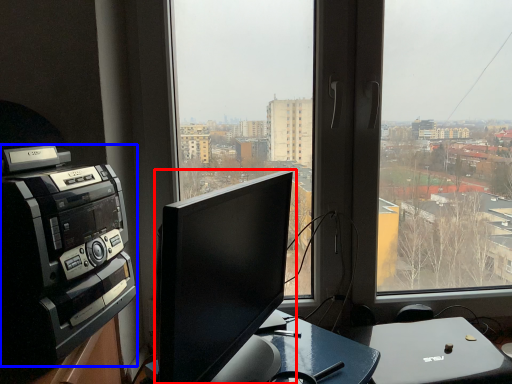
Question: Which object appears farthest to the camera in this image, computer monitor (highlighted by a red box) or amplifier (highlighted by a blue box)?

Choices:
 (A) computer monitor
 (B) amplifier

Answer: (B)